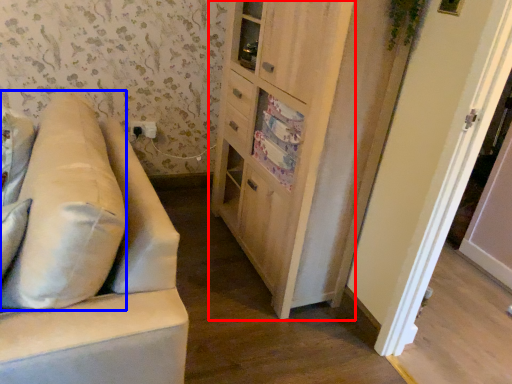
Question: Which point is further to the camera, cabinetry (highlighted by a red box) or pillow (highlighted by a blue box)?

Choices:
 (A) cabinetry
 (B) pillow

Answer: (A)